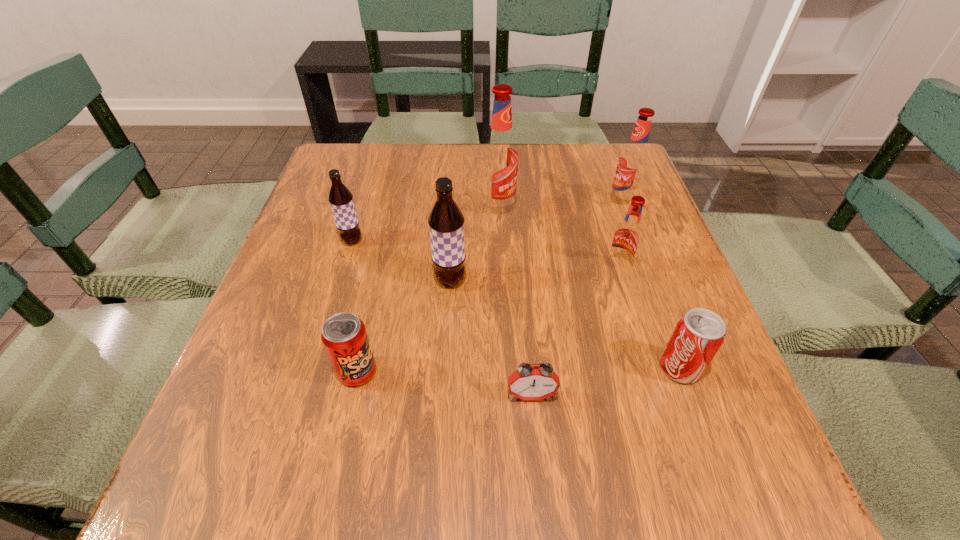
The height and width of the screenshot is (540, 960). Identify the location of the leftmost red root beer. (499, 160).

Find the location of `the tallest object`. the tallest object is located at coordinates pyautogui.click(x=499, y=160).

In order to click on the rightmost root beer in this screenshot , I will do `click(633, 161)`.

Find the location of `the rightmost red root beer`. the rightmost red root beer is located at coordinates (633, 161).

In order to click on the second root beer from left to right in this screenshot , I will do `click(446, 222)`.

This screenshot has width=960, height=540. I want to click on the nearer brown root beer, so click(446, 222).

What are the coordinates of `the nearest red root beer` in the screenshot? It's located at (627, 236).

Where is `the second red root beer from right to left`? the second red root beer from right to left is located at coordinates (627, 236).

This screenshot has width=960, height=540. I want to click on the farther brown root beer, so click(x=340, y=198).

This screenshot has width=960, height=540. What are the coordinates of `the third nearest root beer` in the screenshot? It's located at (340, 198).